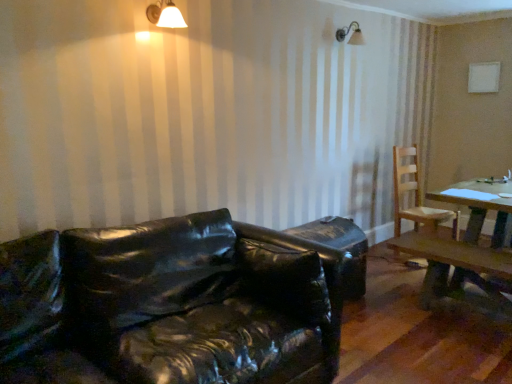
Question: From the image's perspective, is glossy black leather couch at lower left located above or below light brown wooden chair at right?

Choices:
 (A) above
 (B) below

Answer: (B)

Question: Is glossy black leather couch at lower left taller or shorter than light brown wooden chair at right?

Choices:
 (A) short
 (B) tall

Answer: (A)

Question: Estimate the real-world distances between objects in this image. Which object is farther from the glossy black leather couch at lower left?

Choices:
 (A) wooden table at right
 (B) white matte light fixture at upper center
 (C) light brown wooden chair at right

Answer: (C)

Question: Which is nearer to the light brown wooden chair at right?

Choices:
 (A) wooden table at right
 (B) white matte light fixture at upper center
 (C) glossy black leather couch at lower left

Answer: (A)